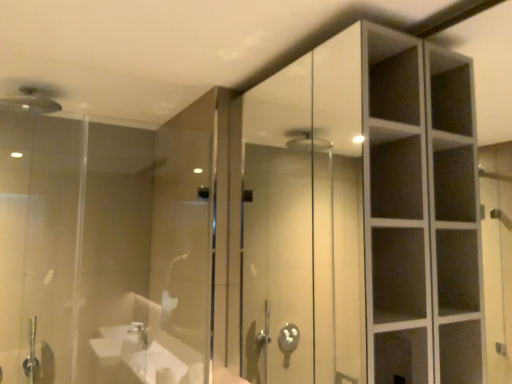
Identify the location of white glossy cabinet at upper right. This screenshot has width=512, height=384. (362, 217).

The height and width of the screenshot is (384, 512). What do you see at coordinates (362, 217) in the screenshot?
I see `white glossy cabinet at upper right` at bounding box center [362, 217].

Where is `white glossy cabinet at upper right`? white glossy cabinet at upper right is located at coordinates (362, 217).